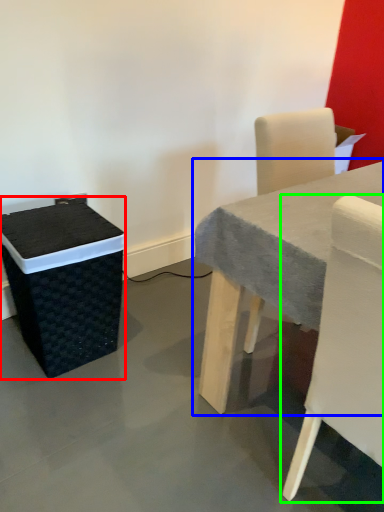
Question: Estimate the real-world distances between objects in this image. Which object is farther from storage box (highlighted by a red box), table (highlighted by a blue box) or chair (highlighted by a green box)?

Choices:
 (A) table
 (B) chair

Answer: (B)